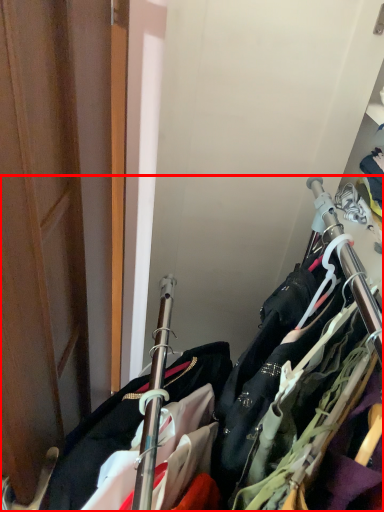
Question: Where is closet (annotated by the red box) located in relation to door in the image?

Choices:
 (A) left
 (B) right

Answer: (B)